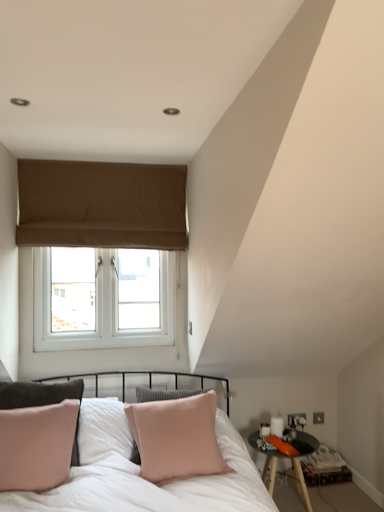
Image resolution: width=384 pixels, height=512 pixels. Find the location of `black wooden table at lower right`. black wooden table at lower right is located at coordinates point(276,467).

What do you see at coordinates (101, 205) in the screenshot?
I see `brown fabric window at upper center` at bounding box center [101, 205].

Consider the image. What is the approximate width of pink velvet pillow at center?

The width of pink velvet pillow at center is 13.71 inches.

This screenshot has height=512, width=384. Find the location of `black wooden table at lower right`. black wooden table at lower right is located at coordinates (276, 467).

Can you see black wooden table at lower right touching brown fabric window at upper center?

No, black wooden table at lower right is not beside brown fabric window at upper center.

Looking at their sizes, would you say black wooden table at lower right is wider or thinner than brown fabric window at upper center?

Considering their sizes, black wooden table at lower right looks broader than brown fabric window at upper center.

From a real-world perspective, does black wooden table at lower right sit lower than brown fabric window at upper center?

Yes.

Is brown fabric window at upper center inside or outside of black wooden table at lower right?

brown fabric window at upper center is spatially situated outside black wooden table at lower right.

From a real-world perspective, is brown fabric window at upper center on black wooden table at lower right?

Yes, from a real-world perspective, brown fabric window at upper center is above black wooden table at lower right.

The width and height of the screenshot is (384, 512). I want to click on table located in front of the brown fabric window at upper center, so click(x=276, y=467).

Is brown fabric window at upper center in front of black wooden table at lower right?

No, it is not.

From a real-world perspective, is black wooden table at lower right above or below pink velvet pillow at center?

black wooden table at lower right is situated lower than pink velvet pillow at center in the real world.

Is pink velvet pillow at center at the back of black wooden table at lower right?

No, black wooden table at lower right's orientation is not away from pink velvet pillow at center.

Find the location of `pillow that appears above the black wooden table at lower right (from the image's perspective)`. pillow that appears above the black wooden table at lower right (from the image's perspective) is located at coordinates (177, 437).

Would you consider pink velvet pillow at center to be distant from black wooden table at lower right?

No.

Which object is positioned more to the left, pink velvet pillow at center or black wooden table at lower right?

pink velvet pillow at center.

Is pink velvet pillow at center facing away from black wooden table at lower right?

No, pink velvet pillow at center is not facing the opposite direction of black wooden table at lower right.

You are a GUI agent. You are given a task and a screenshot of the screen. Output one action in this format:
    pyautogui.click(x=<x>, y=<y>)
    Task: Click on the table behind the pink velvet pillow at center
    The height and width of the screenshot is (512, 384).
    Given the screenshot: What is the action you would take?
    276,467

Locate an element on the screen. This screenshot has height=512, width=384. window that is above the pink velvet pillow at center (from a real-world perspective) is located at coordinates (101, 205).

Based on the photo, from a real-world perspective, is pink velvet pillow at center physically above brown fabric window at upper center?

No, from a real-world perspective, pink velvet pillow at center is not over brown fabric window at upper center

Based on the photo, between pink velvet pillow at center and brown fabric window at upper center, which one has less height?

With less height is pink velvet pillow at center.

Does pink velvet pillow at center lie in front of brown fabric window at upper center?

That is True.

In order to click on pillow in front of the brown fabric window at upper center in this screenshot , I will do `click(177, 437)`.

Is brown fabric window at upper center positioned far away from pink velvet pillow at center?

Yes, brown fabric window at upper center is far from pink velvet pillow at center.

Which is behind, brown fabric window at upper center or pink velvet pillow at center?

brown fabric window at upper center is further away from the camera.

Could you tell me if brown fabric window at upper center is facing pink velvet pillow at center?

Yes.

Where is `window on the left of black wooden table at lower right`? window on the left of black wooden table at lower right is located at coordinates (101, 205).

The height and width of the screenshot is (512, 384). Identify the location of window lying behind the black wooden table at lower right. (101, 205).

In the scene shown: Which object lies further to the anchor point pink velvet pillow at center, brown fabric window at upper center or black wooden table at lower right?

brown fabric window at upper center.

Estimate the real-world distances between objects in this image. Which object is further from black wooden table at lower right, pink velvet pillow at center or brown fabric window at upper center?

Based on the image, brown fabric window at upper center appears to be further to black wooden table at lower right.

From the image, which object appears to be farther from brown fabric window at upper center, pink velvet pillow at center or black wooden table at lower right?

Based on the image, black wooden table at lower right appears to be further to brown fabric window at upper center.

When comparing their distances from brown fabric window at upper center, does black wooden table at lower right or pink velvet pillow at center seem closer?

Based on the image, pink velvet pillow at center appears to be nearer to brown fabric window at upper center.

Looking at this image, when comparing their distances from pink velvet pillow at center, does black wooden table at lower right or brown fabric window at upper center seem closer?

Based on the image, black wooden table at lower right appears to be nearer to pink velvet pillow at center.

From the image, which object appears to be farther from black wooden table at lower right, brown fabric window at upper center or pink velvet pillow at center?

brown fabric window at upper center.

Find the location of a particular element. pillow between brown fabric window at upper center and black wooden table at lower right from top to bottom is located at coordinates (177, 437).